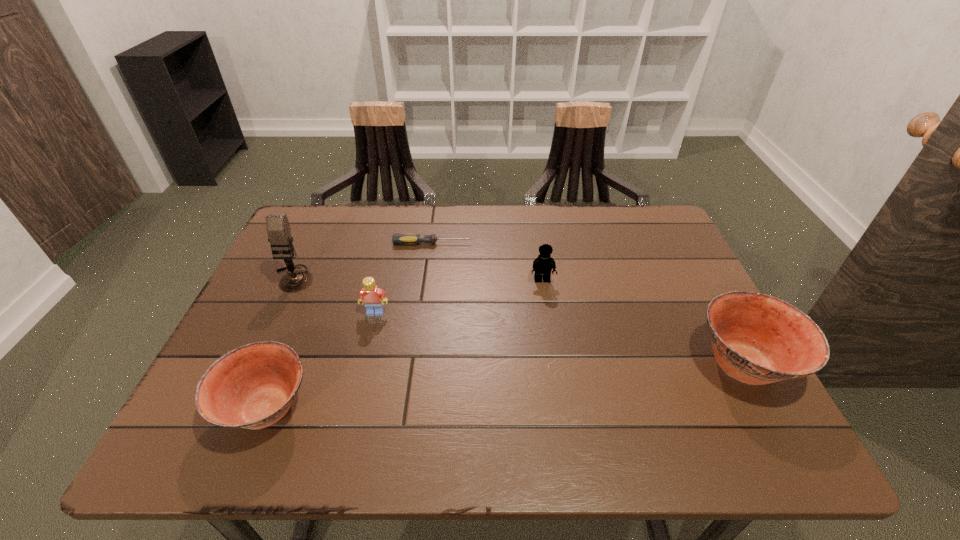
The width and height of the screenshot is (960, 540). Identify the location of vacant area that satisfies the following two spatial constraints: 1. insert the farthest object into a screw head; 2. on the front-facing side of the left Lego. (423, 313).

Where is `vacant space that satisfies the following two spatial constraints: 1. insert the screwdriver into a screw head; 2. on the front-facing side of the tallest object`? This screenshot has width=960, height=540. vacant space that satisfies the following two spatial constraints: 1. insert the screwdriver into a screw head; 2. on the front-facing side of the tallest object is located at coordinates (428, 278).

Find the location of a particular element. free point that satisfies the following two spatial constraints: 1. on the front-facing side of the rightmost object; 2. on the right side of the tallest object is located at coordinates (252, 365).

Find the location of `free location that satisfies the following two spatial constraints: 1. on the front-facing side of the taller bowl; 2. on the right side of the right Lego`. free location that satisfies the following two spatial constraints: 1. on the front-facing side of the taller bowl; 2. on the right side of the right Lego is located at coordinates (555, 365).

Locate an element on the screen. vacant area in the image that satisfies the following two spatial constraints: 1. on the front-facing side of the left bowl; 2. on the left side of the microphone is located at coordinates (232, 409).

Locate an element on the screen. vacant space that satisfies the following two spatial constraints: 1. on the front-facing side of the fifth object from left to right; 2. on the right side of the taller bowl is located at coordinates (555, 365).